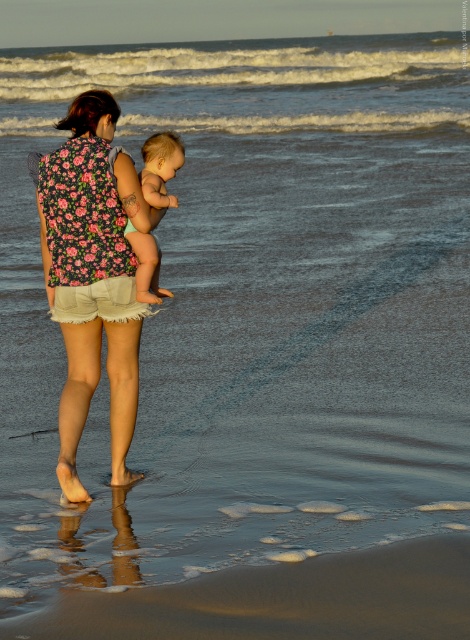
What is the coordinate of sandy brown at lower center?

The coordinate of sandy brown at lower center is at point (281, 600).

You are standing at the beach and want to place a small flag at the closest point between point [117,627] and point [153,173]. Which point should you choose?

Point [117,627] is closer to the viewer than point [153,173], so you should place the flag at point [117,627].